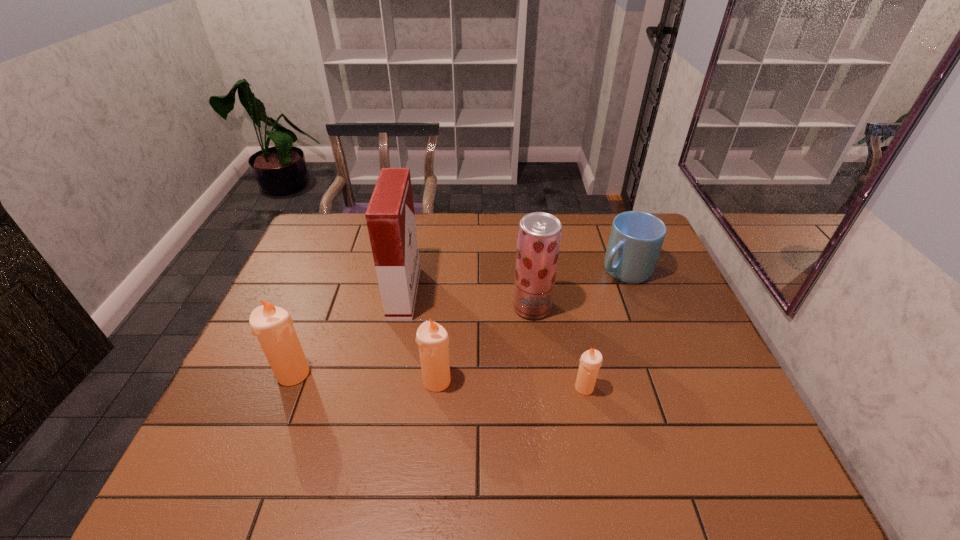
You are a GUI agent. You are given a task and a screenshot of the screen. Output one action in this format:
    pyautogui.click(x=<x>, y=<y>)
    Task: Click on the object that is the closest to the third object from left to right
    The image size is (960, 540).
    Given the screenshot: What is the action you would take?
    pyautogui.click(x=390, y=217)

Identify the location of candle that is the closest one to the rightmost candle. (433, 340).

Where is `candle that is the closest to the fourth object from left to right`? The width and height of the screenshot is (960, 540). candle that is the closest to the fourth object from left to right is located at coordinates (591, 360).

You are a GUI agent. You are given a task and a screenshot of the screen. Output one action in this format:
    pyautogui.click(x=<x>, y=<y>)
    Task: Click on the blank space that satisfies the following two spatial constraints: 1. on the front-facing side of the second object from left to right; 2. on the left side of the shortest object
    The image size is (960, 540).
    Given the screenshot: What is the action you would take?
    pyautogui.click(x=386, y=388)

Where is `vacant area in the image that satisfies the following two spatial constraints: 1. on the front-facing side of the tallest object; 2. on the left side of the third object from right to left`? The height and width of the screenshot is (540, 960). vacant area in the image that satisfies the following two spatial constraints: 1. on the front-facing side of the tallest object; 2. on the left side of the third object from right to left is located at coordinates 401,307.